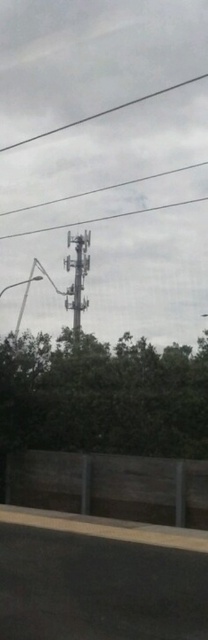
Question: Is green leafy tree at center to the left of metallic gray tower at center from the viewer's perspective?

Choices:
 (A) yes
 (B) no

Answer: (B)

Question: Can you confirm if green leafy tree at center is positioned to the left of metallic gray tower at center?

Choices:
 (A) yes
 (B) no

Answer: (B)

Question: Which object appears farthest from the camera in this image?

Choices:
 (A) metallic gray tower at center
 (B) green leafy tree at center

Answer: (A)

Question: Can you confirm if green leafy tree at center is positioned to the left of metallic gray tower at center?

Choices:
 (A) yes
 (B) no

Answer: (B)

Question: Which object is farther from the camera taking this photo?

Choices:
 (A) metallic gray tower at center
 (B) green leafy tree at center

Answer: (A)